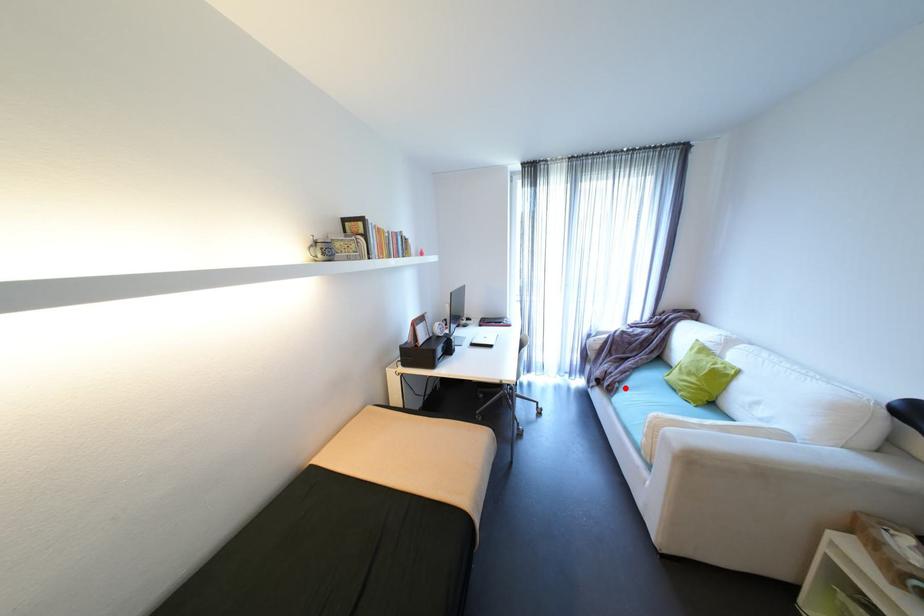
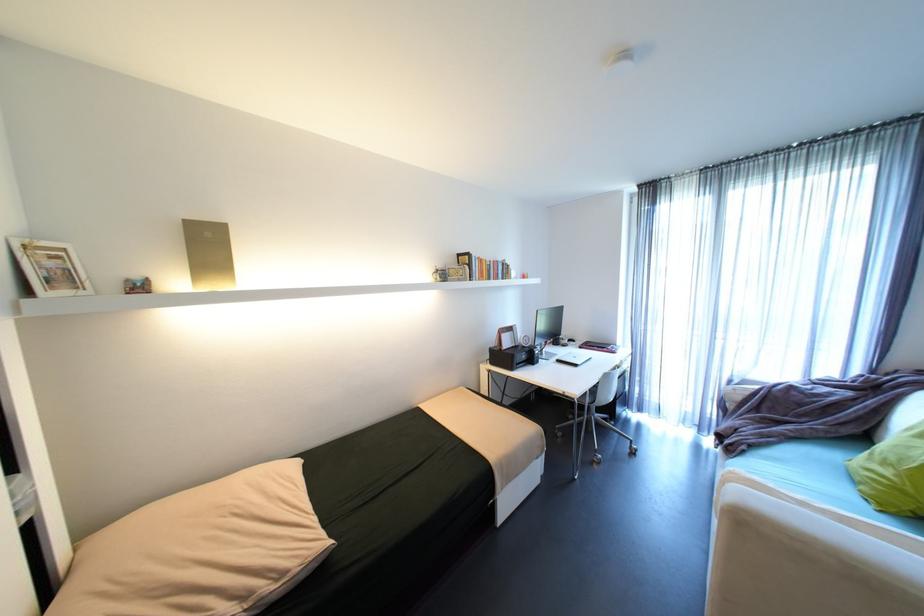
In the second image, find the point that corresponds to the highlighted location in the first image.

(751, 451)